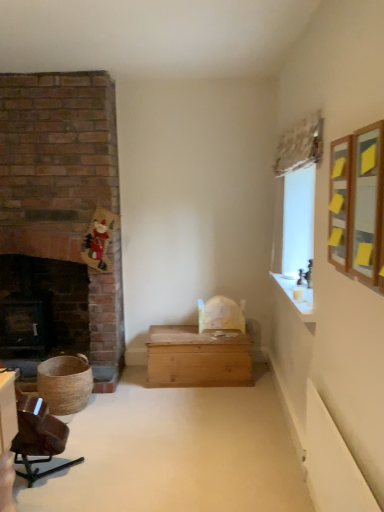
Question: Can you confirm if black cast iron fireplace at left is smaller than white glossy mantle at upper right?

Choices:
 (A) no
 (B) yes

Answer: (A)

Question: From the image's perspective, does black cast iron fireplace at left appear lower than white glossy mantle at upper right?

Choices:
 (A) yes
 (B) no

Answer: (A)

Question: Considering the relative positions of black cast iron fireplace at left and white glossy mantle at upper right in the image provided, is black cast iron fireplace at left in front of white glossy mantle at upper right?

Choices:
 (A) yes
 (B) no

Answer: (B)

Question: Is black cast iron fireplace at left wider than white glossy mantle at upper right?

Choices:
 (A) no
 (B) yes

Answer: (B)

Question: Is black cast iron fireplace at left positioned with its back to white glossy mantle at upper right?

Choices:
 (A) yes
 (B) no

Answer: (B)

Question: Considering the relative positions of black cast iron fireplace at left and white glossy mantle at upper right in the image provided, is black cast iron fireplace at left to the right of white glossy mantle at upper right from the viewer's perspective?

Choices:
 (A) no
 (B) yes

Answer: (A)

Question: Can you confirm if black cast iron fireplace at left is shorter than wooden chest at center?

Choices:
 (A) no
 (B) yes

Answer: (A)

Question: From the image's perspective, is black cast iron fireplace at left located beneath wooden chest at center?

Choices:
 (A) no
 (B) yes

Answer: (A)

Question: Is black cast iron fireplace at left in contact with wooden chest at center?

Choices:
 (A) yes
 (B) no

Answer: (B)

Question: Can we say black cast iron fireplace at left lies outside wooden chest at center?

Choices:
 (A) no
 (B) yes

Answer: (B)

Question: Is the position of black cast iron fireplace at left more distant than that of wooden chest at center?

Choices:
 (A) yes
 (B) no

Answer: (A)

Question: Would you consider black cast iron fireplace at left to be distant from wooden chest at center?

Choices:
 (A) no
 (B) yes

Answer: (B)

Question: From a real-world perspective, is wooden chest at center positioned under white glossy mantle at upper right based on gravity?

Choices:
 (A) yes
 (B) no

Answer: (A)